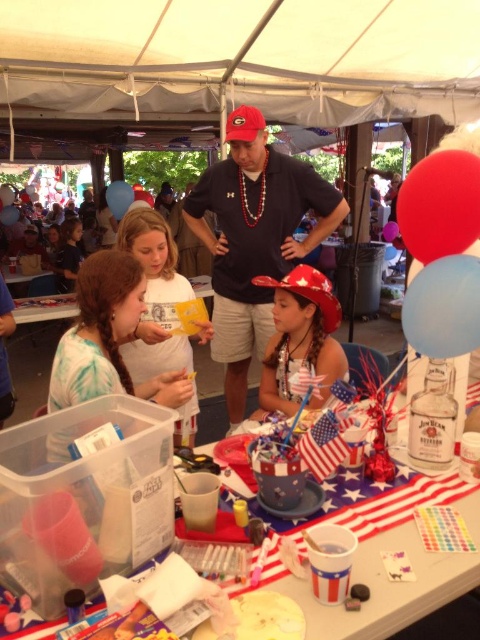
Question: Estimate the real-world distances between objects in this image. Which object is closer to the blue glossy balloon at upper center?

Choices:
 (A) red matte baseball hat at center
 (B) matte red baseball cap at center
 (C) blue latex balloon at center

Answer: (B)

Question: Where is shiny red cowboy hat at center located in relation to red matte balloon at upper right in the image?

Choices:
 (A) right
 (B) left

Answer: (B)

Question: Is red matte baseball hat at center behind blue glossy balloon at upper center?

Choices:
 (A) no
 (B) yes

Answer: (A)

Question: Is rubber matte balloon at upper right behind matte red baseball cap at center?

Choices:
 (A) yes
 (B) no

Answer: (B)

Question: Which object is the closest to the blue glossy balloon at upper center?

Choices:
 (A) matte red baseball cap at center
 (B) rubber matte balloon at upper right

Answer: (A)

Question: Which point appears farthest from the camera in this image?

Choices:
 (A) (144, 285)
 (B) (199, 230)
 (C) (291, 330)
 (D) (384, 236)

Answer: (D)